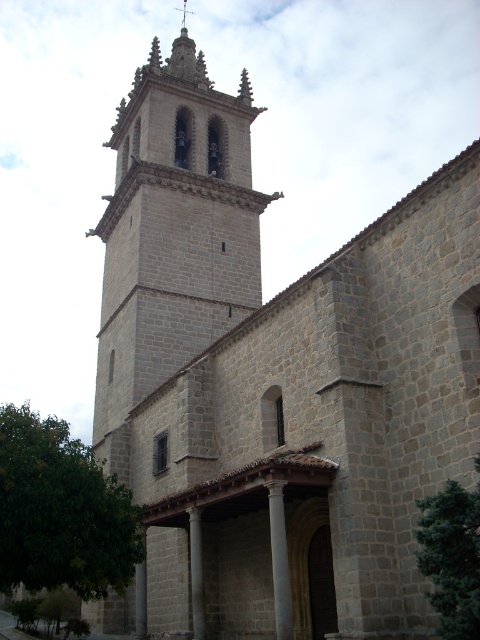
Who is higher up, gray stone column at center or smooth stone spire at upper center?

smooth stone spire at upper center is higher up.

Which is behind, point (279, 628) or point (182, 3)?

The point (182, 3) is behind.

Is point (275, 604) positioned before point (177, 8)?

Yes, point (275, 604) is in front of point (177, 8).

The width and height of the screenshot is (480, 640). What are the coordinates of `gray stone column at center` in the screenshot? It's located at (279, 561).

Which is in front, point (197, 257) or point (192, 532)?

Point (192, 532) is more forward.

Can you confirm if gray stone tower at center is thinner than gray stone pillar at center?

Incorrect, gray stone tower at center's width is not less than gray stone pillar at center's.

Describe the element at coordinates (173, 230) in the screenshot. The width and height of the screenshot is (480, 640). I see `gray stone tower at center` at that location.

Image resolution: width=480 pixels, height=640 pixels. Identify the location of gray stone tower at center. (173, 230).

Based on the photo, can you confirm if gray stone pillar at lower center is taller than smooth stone spire at upper center?

No.

Who is more forward, (140, 632) or (186, 29)?

Point (140, 632) is more forward.

Which is behind, point (134, 608) or point (182, 1)?

The point (182, 1) is more distant.

Identify the location of gray stone pillar at lower center. This screenshot has width=480, height=640. (141, 593).